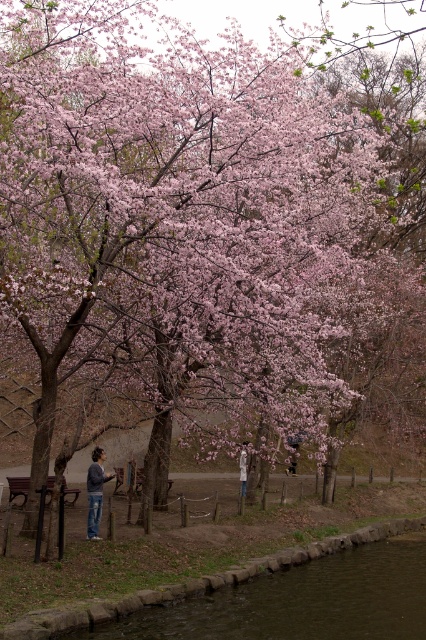
Who is shorter, denim jeans at center or wooden park bench at center?

Standing shorter between the two is wooden park bench at center.

Between denim jeans at center and wooden park bench at center, which one is positioned higher?

Positioned higher is denim jeans at center.

Does point (97, 448) lie in front of point (140, 492)?

Yes.

Find the location of `denim jeans at center`. denim jeans at center is located at coordinates (95, 492).

Does point (11, 499) lie behind point (141, 484)?

No.

Where is `wooden bench at lower left`? The height and width of the screenshot is (640, 426). wooden bench at lower left is located at coordinates (17, 486).

Is denim jeans at center wider than light brown leather jacket at center?

Yes, denim jeans at center is wider than light brown leather jacket at center.

Can you confirm if denim jeans at center is thinner than light brown leather jacket at center?

Incorrect, denim jeans at center's width is not less than light brown leather jacket at center's.

Does point (95, 531) come farther from viewer compared to point (241, 449)?

No, it is in front of (241, 449).

Find the location of a particular element. The height and width of the screenshot is (640, 426). denim jeans at center is located at coordinates (95, 492).